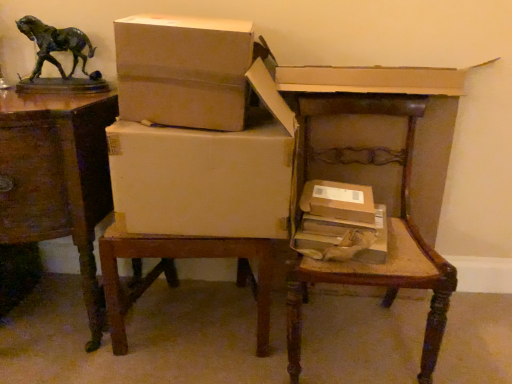
This screenshot has width=512, height=384. In order to click on free space in front of bronze horse at upper left in this screenshot , I will do `click(47, 101)`.